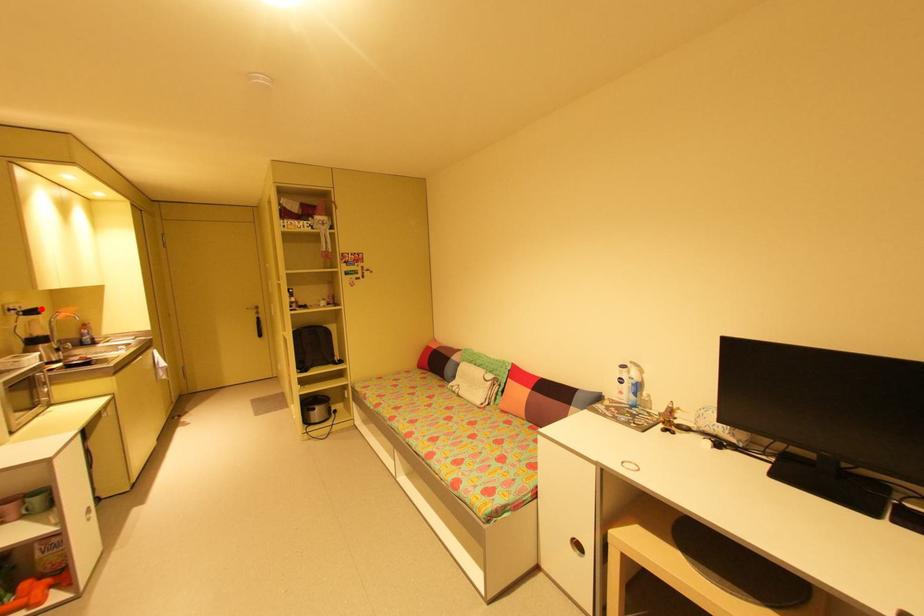
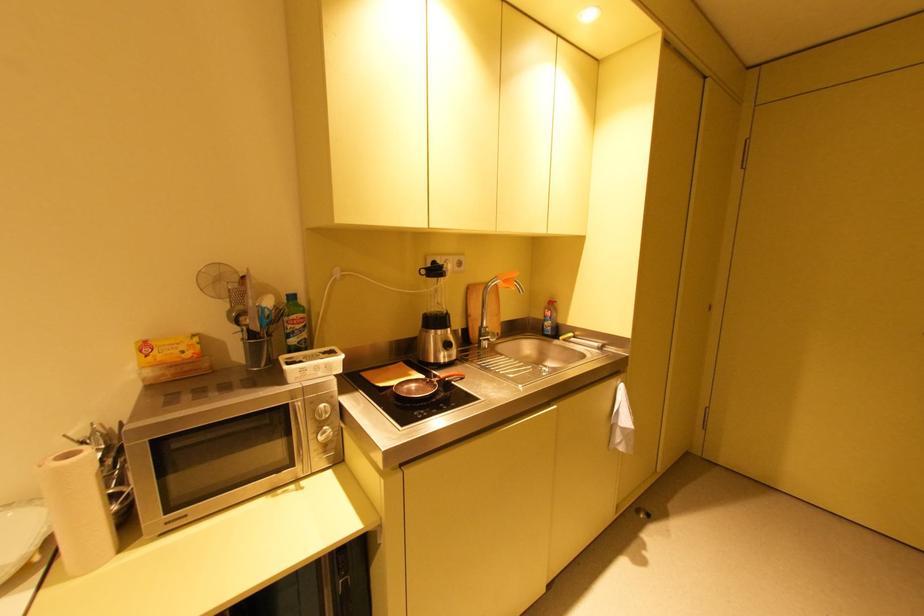
The point at the highlighted location is marked in the first image. Where is the corresponding point in the second image?

(444, 267)